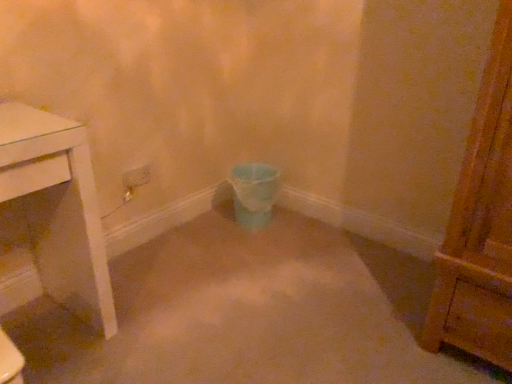
Question: Is matte blue plastic toilet bowl at center in front of or behind white plastic power plugs and sockets at center in the image?

Choices:
 (A) front
 (B) behind

Answer: (B)

Question: In terms of height, does matte blue plastic toilet bowl at center look taller or shorter compared to white plastic power plugs and sockets at center?

Choices:
 (A) tall
 (B) short

Answer: (A)

Question: From a real-world perspective, is matte blue plastic toilet bowl at center above or below white plastic power plugs and sockets at center?

Choices:
 (A) below
 (B) above

Answer: (A)

Question: From a real-world perspective, is white plastic power plugs and sockets at center positioned above or below matte blue plastic toilet bowl at center?

Choices:
 (A) below
 (B) above

Answer: (B)

Question: From the image's perspective, is white plastic power plugs and sockets at center positioned above or below matte blue plastic toilet bowl at center?

Choices:
 (A) above
 (B) below

Answer: (A)

Question: Is point (132, 183) positioned closer to the camera than point (267, 175)?

Choices:
 (A) farther
 (B) closer

Answer: (B)

Question: Based on their sizes in the image, would you say white plastic power plugs and sockets at center is bigger or smaller than matte blue plastic toilet bowl at center?

Choices:
 (A) small
 (B) big

Answer: (A)